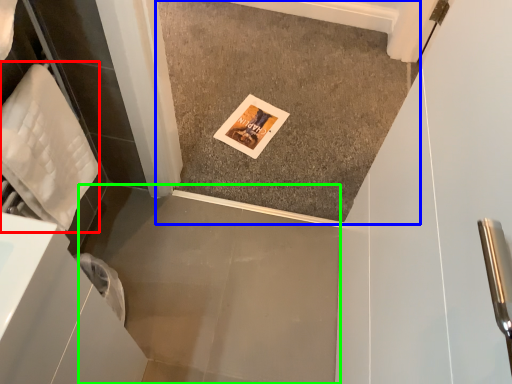
Question: Which object is positioned farthest from material (highlighted by a red box)? Select from concrete (highlighted by a blue box) and concrete (highlighted by a green box).

Choices:
 (A) concrete
 (B) concrete

Answer: (A)